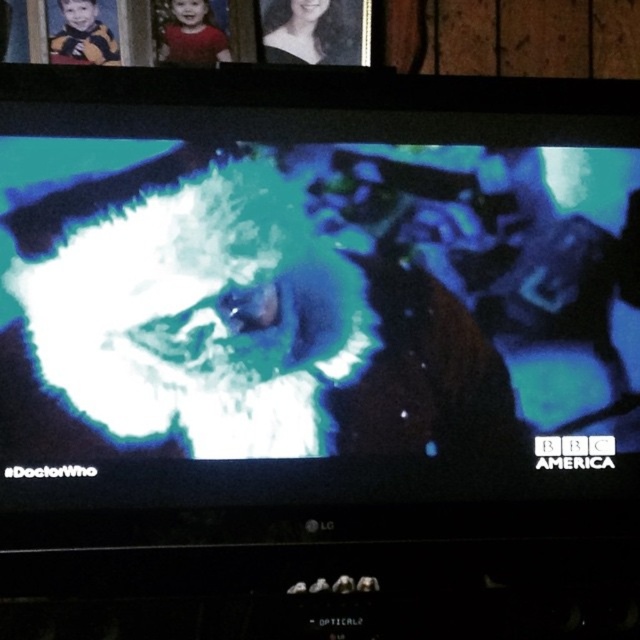
Question: Can you confirm if black matte hair at upper center is thinner than yellow-orange sweater at upper left?

Choices:
 (A) no
 (B) yes

Answer: (A)

Question: Which point is farther to the camera?

Choices:
 (A) (67, 44)
 (B) (184, 12)
 (C) (116, 433)

Answer: (B)

Question: Does black matte hair at upper center appear over red matte shirt at upper center?

Choices:
 (A) no
 (B) yes

Answer: (B)

Question: Which of the following is the closest to the observer?

Choices:
 (A) (330, 61)
 (B) (93, 13)
 (C) (545, 332)
 (D) (179, 35)

Answer: (C)

Question: Considering the relative positions of black matte hair at upper center and yellow-orange sweater at upper left in the image provided, where is black matte hair at upper center located with respect to yellow-orange sweater at upper left?

Choices:
 (A) right
 (B) left

Answer: (A)

Question: Which of these objects is positioned closest to the white foggy cloud at center?

Choices:
 (A) red matte shirt at upper center
 (B) yellow-orange sweater at upper left

Answer: (A)